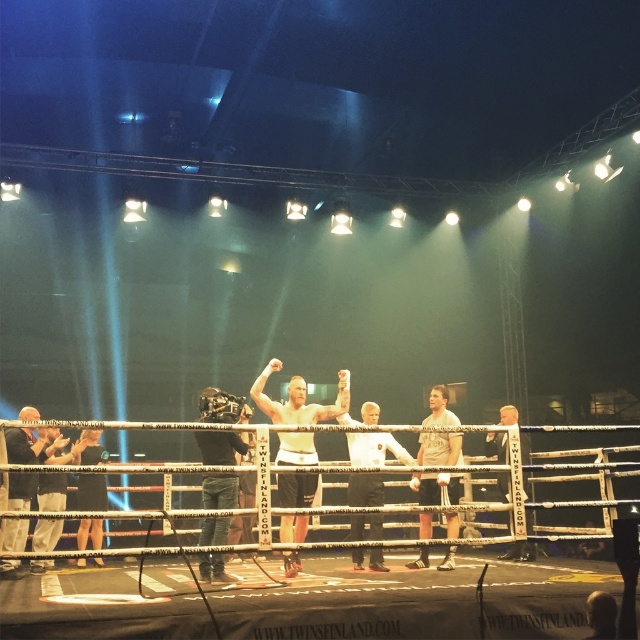
Question: Among these objects, which one is nearest to the camera?

Choices:
 (A) matte white shirt at center
 (B) light gray cotton shirt at center
 (C) dark gray fabric jacket at left
 (D) white fabric banner at center

Answer: (B)

Question: Estimate the real-world distances between objects in this image. Which object is closer to the matte white shirt at center?

Choices:
 (A) denim jeans at center
 (B) light gray cotton shirt at center
 (C) white fabric banner at center

Answer: (A)

Question: Does matte white shirt at center lie behind denim jeans at center?

Choices:
 (A) yes
 (B) no

Answer: (A)

Question: Observing the image, what is the correct spatial positioning of dark gray fabric jacket at left in reference to white fabric banner at center?

Choices:
 (A) below
 (B) above

Answer: (A)

Question: Is denim jeans at center above dark gray fabric jacket at left?

Choices:
 (A) no
 (B) yes

Answer: (B)

Question: Which is nearer to the dark gray fabric jacket at left?

Choices:
 (A) white fabric banner at center
 (B) light gray cotton shirt at center
 (C) denim jeans at center
 (D) matte white shirt at center

Answer: (C)